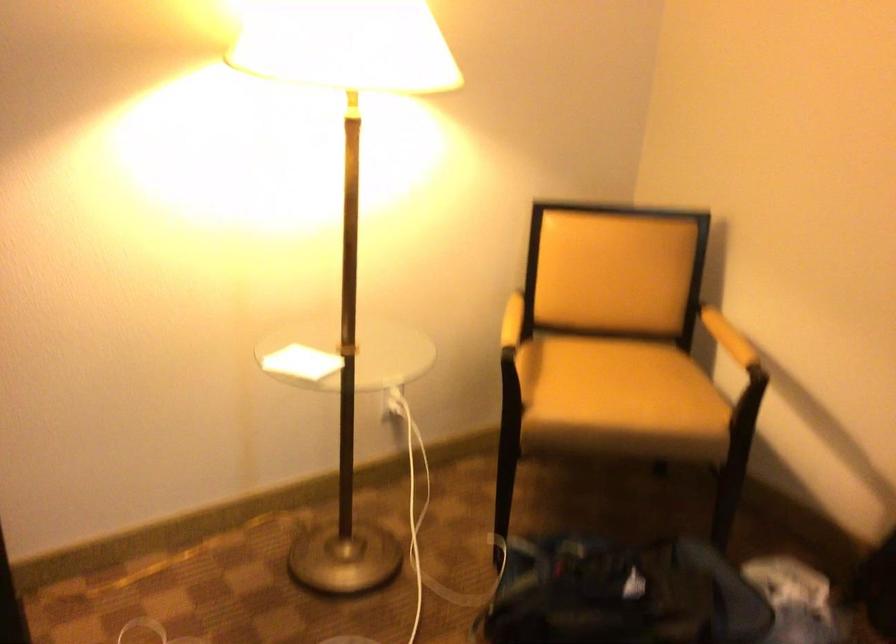
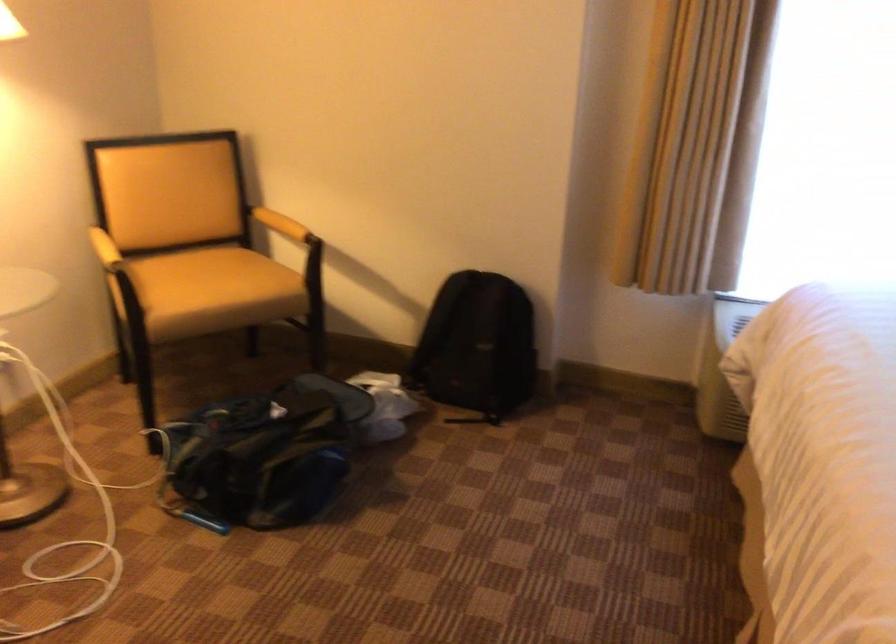
Question: Based on the continuous images, in which direction is the camera rotating? Reply with the corresponding letter.

Choices:
 (A) Left
 (B) Right
 (C) Up
 (D) Down

Answer: (B)